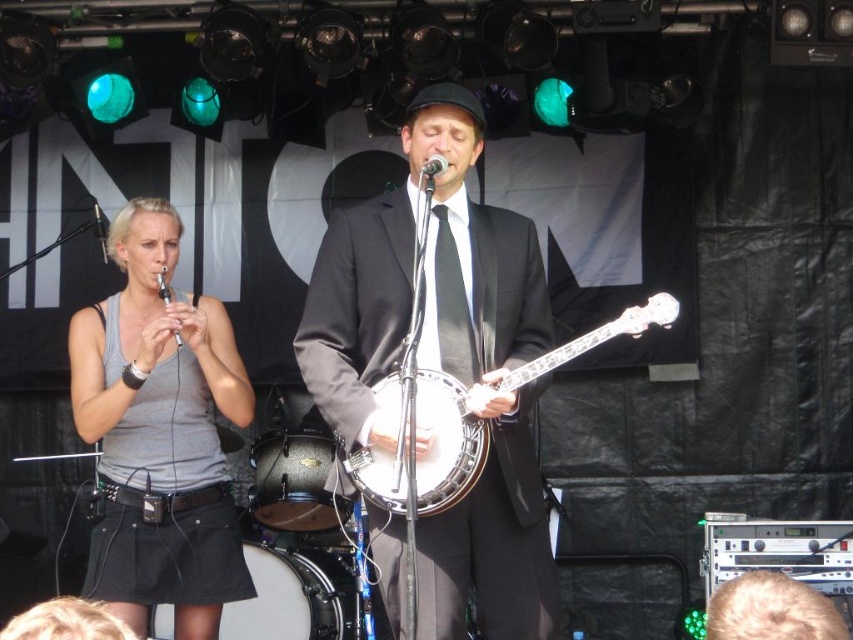
Can you confirm if gray fabric skirt at left is positioned above white wooden banjo at center?

No.

Who is more distant from viewer, (x=112, y=410) or (x=410, y=424)?

Point (x=112, y=410)

Identify the location of gray fabric skirt at left. (160, 433).

Which is above, matte black banjo at center or white wooden banjo at center?

matte black banjo at center is higher up.

Which is more to the left, matte black banjo at center or white wooden banjo at center?

Positioned to the left is matte black banjo at center.

This screenshot has width=853, height=640. What are the coordinates of `matte black banjo at center` in the screenshot? It's located at (444, 365).

Based on the photo, how much distance is there between matte black banjo at center and gray fabric skirt at left?

They are 37.57 inches apart.

Between matte black banjo at center and gray fabric skirt at left, which one appears on the right side from the viewer's perspective?

matte black banjo at center is more to the right.

Identify the location of matte black banjo at center. The image size is (853, 640). (444, 365).

You are a GUI agent. You are given a task and a screenshot of the screen. Output one action in this format:
    pyautogui.click(x=<x>, y=<y>)
    Task: Click on the matte black banjo at center
    Image resolution: width=853 pixels, height=640 pixels.
    Given the screenshot: What is the action you would take?
    pyautogui.click(x=444, y=365)